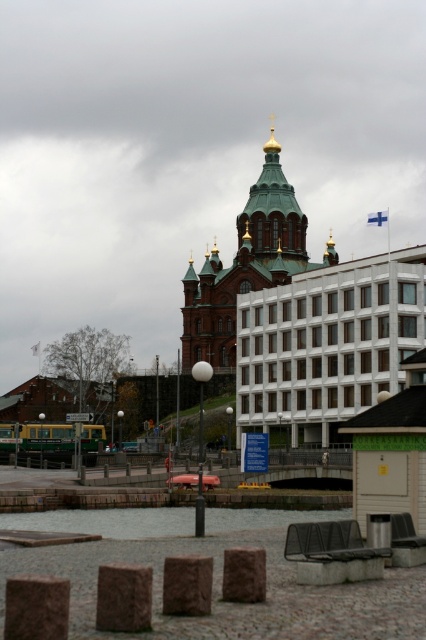
Can you confirm if green metallic dome at center is thinner than clear water at lower center?

No, green metallic dome at center is not thinner than clear water at lower center.

Is point (267, 280) closer to viewer compared to point (187, 532)?

No.

Where is `green metallic dome at center`? green metallic dome at center is located at coordinates (245, 264).